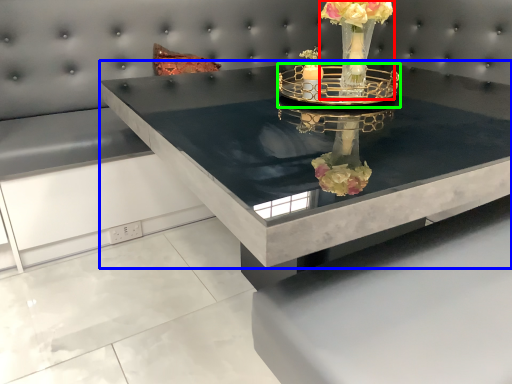
Question: Which is farther away from floral arrangement (highlighted by a red box)? table (highlighted by a blue box) or candle holder (highlighted by a green box)?

Choices:
 (A) table
 (B) candle holder

Answer: (A)